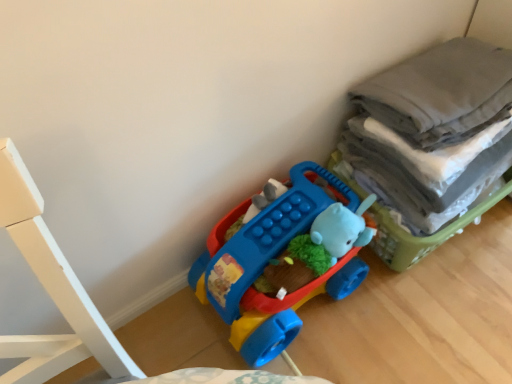
Question: From a real-world perspective, is matte plastic toy car at center over gray cotton laundry at right?

Choices:
 (A) no
 (B) yes

Answer: (A)

Question: Is matte plastic toy car at center wider than gray cotton laundry at right?

Choices:
 (A) yes
 (B) no

Answer: (B)

Question: Can you confirm if matte plastic toy car at center is taller than gray cotton laundry at right?

Choices:
 (A) no
 (B) yes

Answer: (A)

Question: Can you confirm if matte plastic toy car at center is smaller than gray cotton laundry at right?

Choices:
 (A) yes
 (B) no

Answer: (A)

Question: From the image's perspective, is matte plastic toy car at center under gray cotton laundry at right?

Choices:
 (A) no
 (B) yes

Answer: (B)

Question: Is gray cotton laundry at right at the back of matte plastic toy car at center?

Choices:
 (A) no
 (B) yes

Answer: (A)

Question: Does gray cotton laundry at right have a smaller size compared to matte plastic toy car at center?

Choices:
 (A) no
 (B) yes

Answer: (A)

Question: Is gray cotton laundry at right facing towards matte plastic toy car at center?

Choices:
 (A) no
 (B) yes

Answer: (A)

Question: Would you say gray cotton laundry at right is outside matte plastic toy car at center?

Choices:
 (A) yes
 (B) no

Answer: (A)

Question: Does gray cotton laundry at right touch matte plastic toy car at center?

Choices:
 (A) yes
 (B) no

Answer: (B)

Question: Is gray cotton laundry at right far from matte plastic toy car at center?

Choices:
 (A) no
 (B) yes

Answer: (A)

Question: Does gray cotton laundry at right have a lesser width compared to matte plastic toy car at center?

Choices:
 (A) yes
 (B) no

Answer: (B)

Question: From the image's perspective, is gray cotton laundry at right above or below matte plastic toy car at center?

Choices:
 (A) below
 (B) above

Answer: (B)